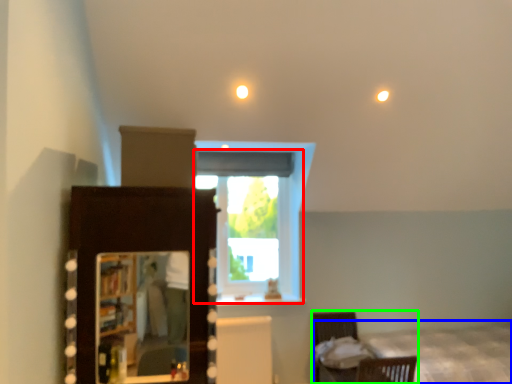
Question: Which is farther away from window (highlighted by a red box)? bed (highlighted by a blue box) or furniture (highlighted by a green box)?

Choices:
 (A) bed
 (B) furniture

Answer: (B)